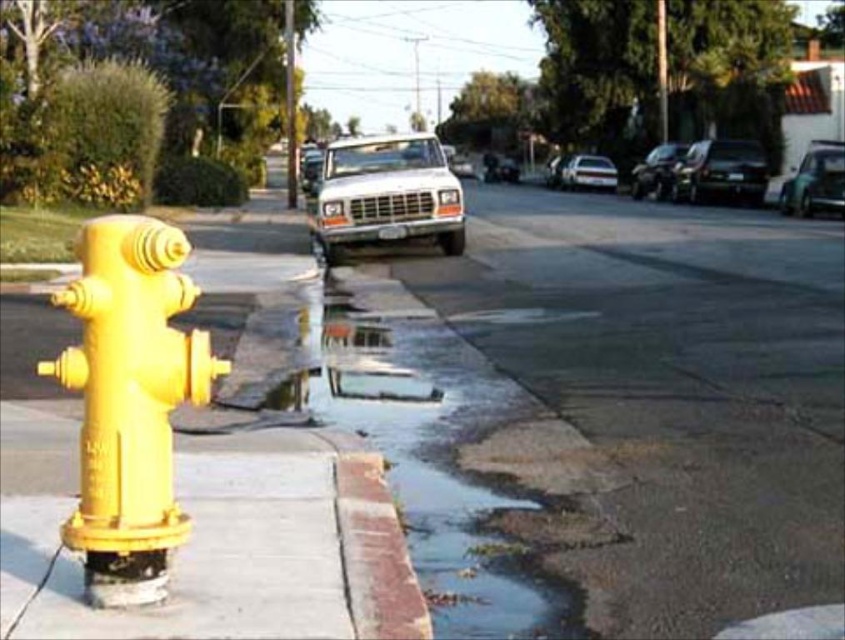
Which is behind, point (508, 378) or point (728, 177)?

Positioned behind is point (728, 177).

Is glossy concrete puddle at lower left smaller than shiny black car at upper right?

No, glossy concrete puddle at lower left is not smaller than shiny black car at upper right.

Does point (276, 346) come behind point (743, 173)?

No, it is in front of (743, 173).

Identify the location of glossy concrete puddle at lower left. (416, 442).

Is yellow matte fire hydrant at left above white matte truck at center?

No.

Can you confirm if yellow matte fire hydrant at left is taller than white matte truck at center?

No, yellow matte fire hydrant at left is not taller than white matte truck at center.

Does point (99, 384) come closer to viewer compared to point (444, 230)?

Yes, it is.

Locate an element on the screen. This screenshot has width=845, height=640. yellow matte fire hydrant at left is located at coordinates (129, 401).

Locate an element on the screen. This screenshot has width=845, height=640. glossy concrete puddle at lower left is located at coordinates (416, 442).

The height and width of the screenshot is (640, 845). I want to click on glossy concrete puddle at lower left, so click(416, 442).

Where is `glossy concrete puddle at lower left`? Image resolution: width=845 pixels, height=640 pixels. glossy concrete puddle at lower left is located at coordinates (416, 442).